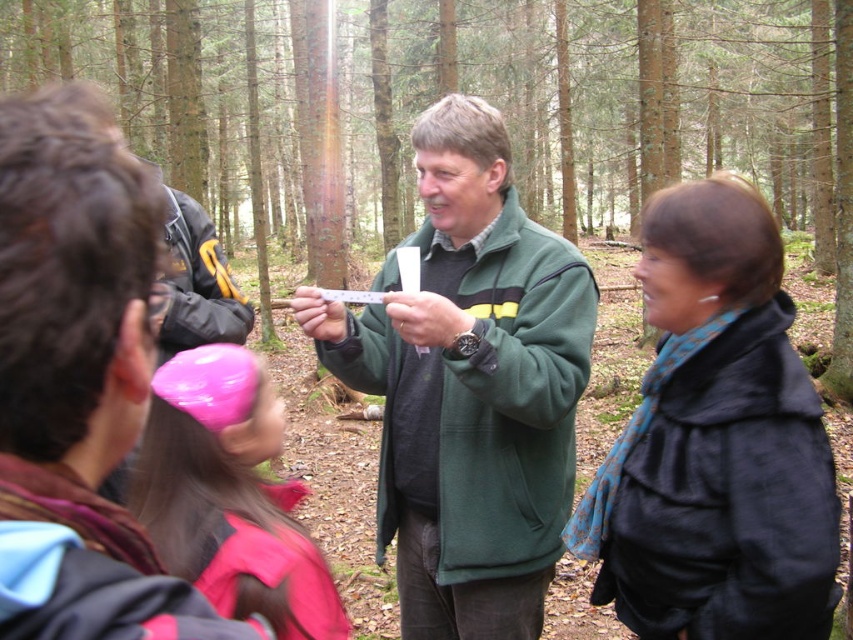
You are a hiker who just arrived at the forest scene. You need to locate the green matte sweater at center. Where exactly should you look?

The green matte sweater at center is located at point (480, 97).

You are a photographer trying to capture a group photo of the green matte sweater at center and the black matte coat at center. Based on their positions and sizes, which one should you position closer to the camera to ensure both appear equally wide in the photo?

The green matte sweater at center might be wider than the black matte coat at center, so to make them appear equally wide in the photo, you should position the black matte coat at center closer to the camera than the green matte sweater at center.

You are a nature guide leading a group in the forest. You notice the black matte coat at center and the pink plastic magnifying glass at upper left. Which object is positioned higher in the image?

The pink plastic magnifying glass at upper left is positioned higher in the image than the black matte coat at center.